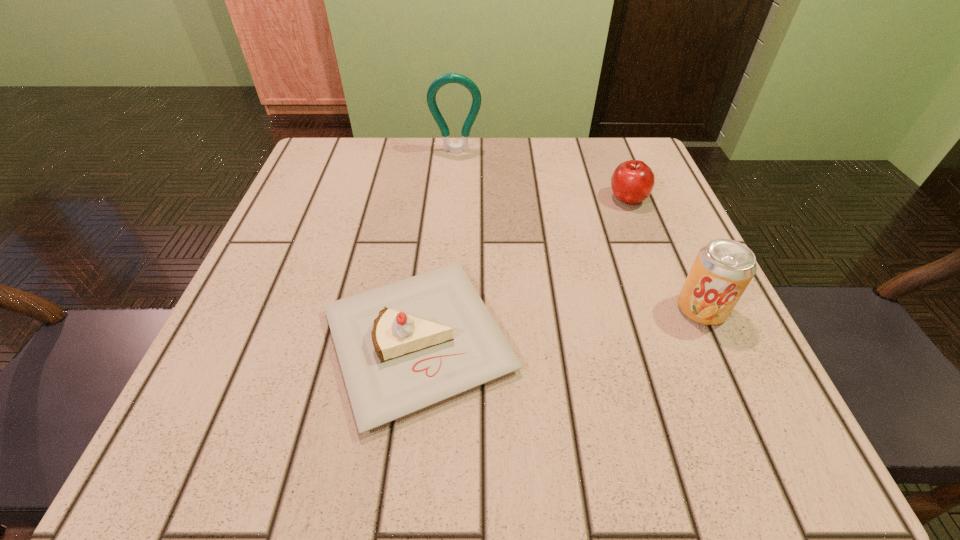
Identify the location of bottle opener that is at the far edge. (452, 77).

Locate an element on the screen. This screenshot has height=540, width=960. apple that is at the far edge is located at coordinates (632, 182).

The image size is (960, 540). What are the coordinates of `object that is at the near edge` in the screenshot? It's located at coord(402,347).

What are the coordinates of `object located in the left edge section of the desktop` in the screenshot? It's located at (402, 347).

Find the location of a particular element. pop (soda) that is at the right edge is located at coordinates (723, 268).

Identify the location of apple at the right edge. (632, 182).

Find the location of a particular element. object at the near left corner is located at coordinates (402, 347).

Locate an element on the screen. The image size is (960, 540). object that is at the far right corner is located at coordinates (632, 182).

You are a GUI agent. You are given a task and a screenshot of the screen. Output one action in this format:
    pyautogui.click(x=<x>, y=<y>)
    Task: Click on the vacant space at the far edge of the desktop
    
    Given the screenshot: What is the action you would take?
    pyautogui.click(x=509, y=188)

Identify the location of vacant space at the near edge. (489, 447).